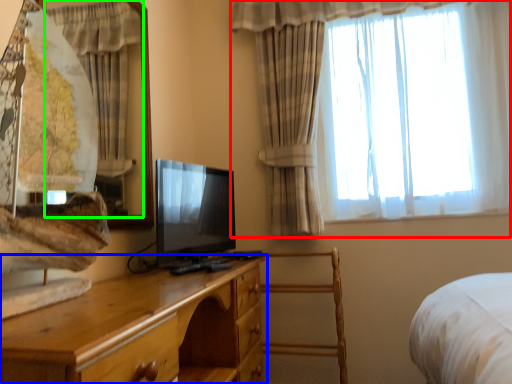
Question: Based on their relative distances, which object is nearer to curtain (highlighted by a red box)? Choose from chest of drawers (highlighted by a blue box) and curtain (highlighted by a green box).

Choices:
 (A) chest of drawers
 (B) curtain

Answer: (B)